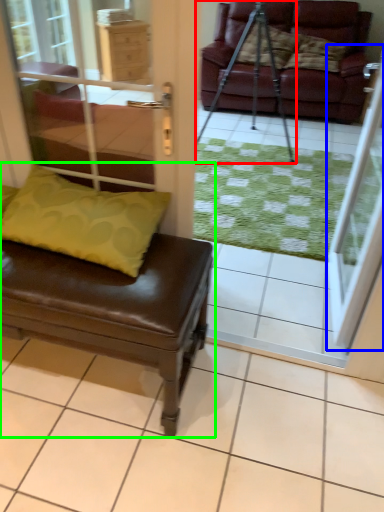
Question: Based on their relative distances, which object is nearer to tripod (highlighted by a red box)? Choose from screen door (highlighted by a blue box) and studio couch (highlighted by a green box).

Choices:
 (A) screen door
 (B) studio couch

Answer: (A)